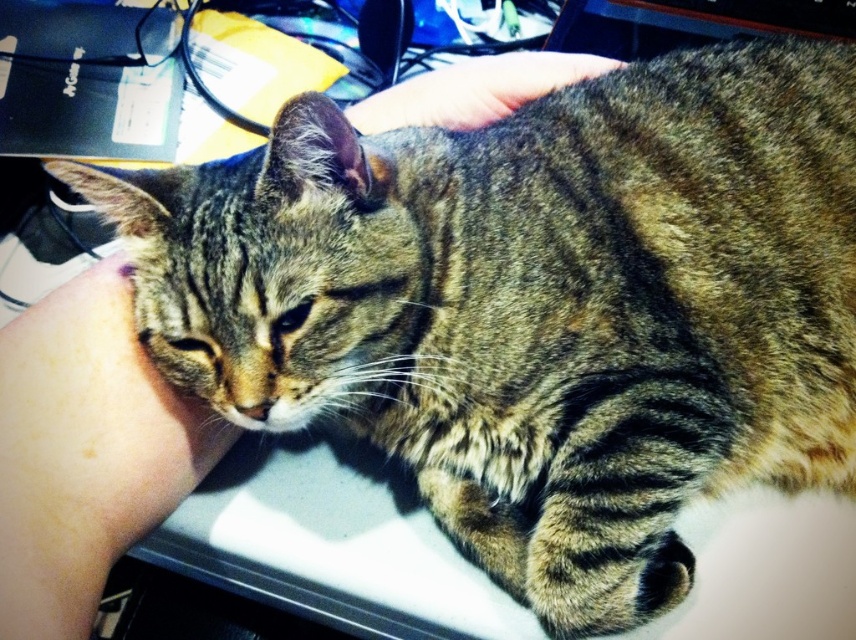
Question: Among these points, which one is nearest to the camera?

Choices:
 (A) tap(4, 488)
 (B) tap(591, 67)

Answer: (A)

Question: Which object is farther from the camera taking this photo?

Choices:
 (A) skinny white skin at lower left
 (B) fur at upper center

Answer: (B)

Question: Is skinny white skin at lower left thinner than fur at upper center?

Choices:
 (A) no
 (B) yes

Answer: (B)

Question: Among these points, which one is nearest to the camera?

Choices:
 (A) (119, 550)
 (B) (456, 113)

Answer: (A)

Question: Is skinny white skin at lower left bigger than fur at upper center?

Choices:
 (A) no
 (B) yes

Answer: (A)

Question: Considering the relative positions of skinny white skin at lower left and fur at upper center in the image provided, where is skinny white skin at lower left located with respect to fur at upper center?

Choices:
 (A) left
 (B) right

Answer: (A)